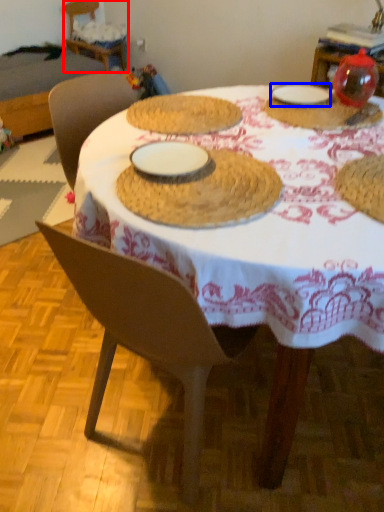
Question: Which object is further to the camera taking this photo, chair (highlighted by a red box) or tableware (highlighted by a blue box)?

Choices:
 (A) chair
 (B) tableware

Answer: (A)